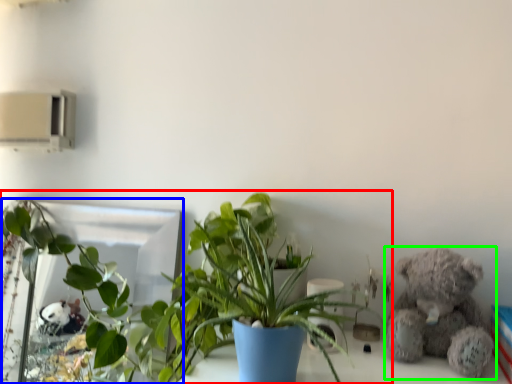
Question: Which object is positioned farthest from houseplant (highlighted by a red box)? Select from mirror (highlighted by a blue box) and teddy bear (highlighted by a green box).

Choices:
 (A) mirror
 (B) teddy bear

Answer: (B)